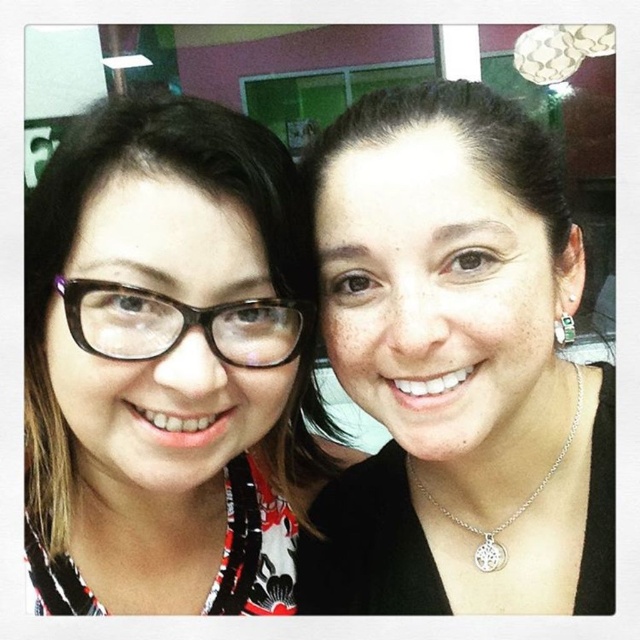
Question: Which point is farther to the camera?

Choices:
 (A) matte black glasses at left
 (B) silver metallic necklace at center
 (C) black plastic glasses at left
 (D) smooth skin face at center

Answer: (B)

Question: Can you confirm if matte black glasses at left is smaller than silver metallic necklace at center?

Choices:
 (A) no
 (B) yes

Answer: (A)

Question: Among these objects, which one is farthest from the camera?

Choices:
 (A) smooth skin face at center
 (B) silver metallic necklace at center
 (C) matte black glasses at left
 (D) black plastic glasses at left

Answer: (B)

Question: Estimate the real-world distances between objects in this image. Which object is farther from the matte black glasses at left?

Choices:
 (A) black plastic glasses at left
 (B) silver metallic necklace at center

Answer: (B)

Question: Where is smooth skin face at center located in relation to silver metallic necklace at center in the image?

Choices:
 (A) above
 (B) below

Answer: (A)

Question: Is matte black glasses at left positioned before black plastic glasses at left?

Choices:
 (A) no
 (B) yes

Answer: (B)